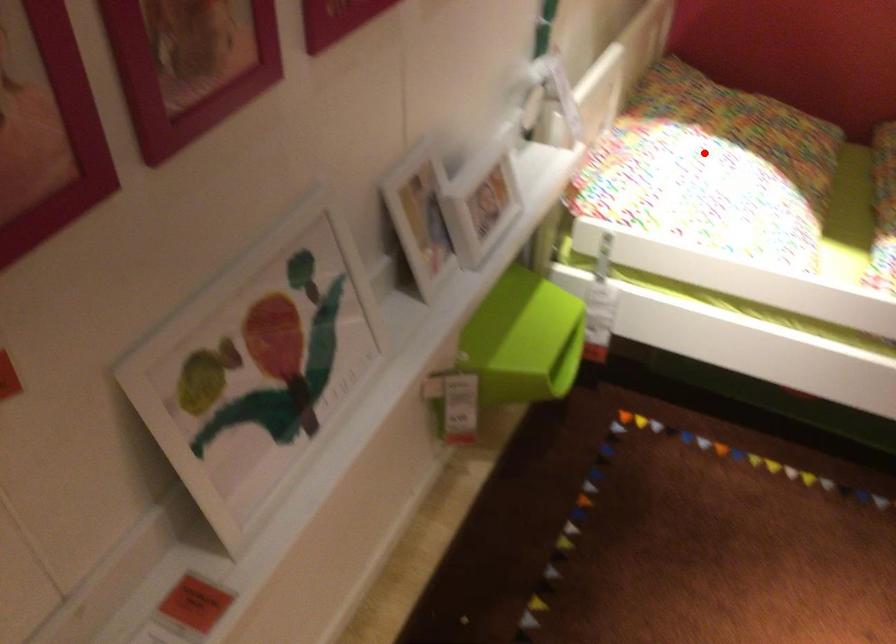
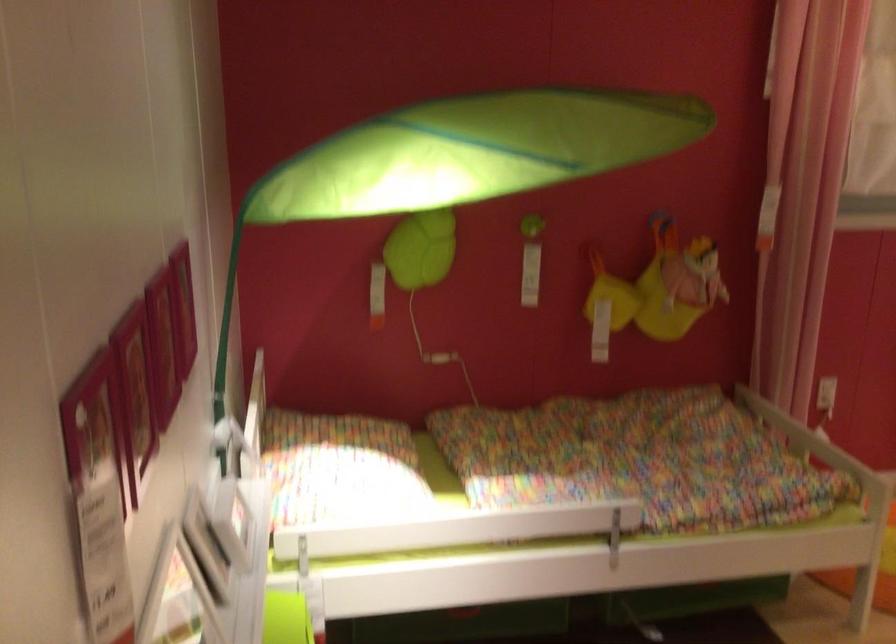
Question: I am providing you with two images of the same scene from different viewpoints. A red point is shown in image1. For the corresponding object point in image2, is it positioned nearer or farther from the camera?

Choices:
 (A) Nearer
 (B) Farther

Answer: (B)